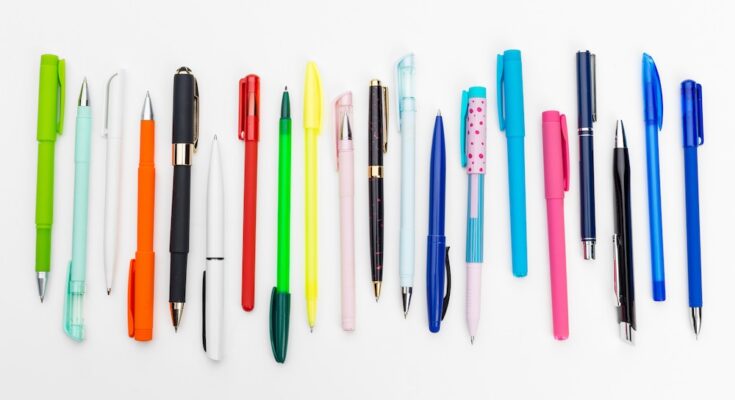
What are the coordinates of `pens with tips facing up` in the screenshot? It's located at (89, 96), (148, 111), (215, 151), (284, 117), (342, 112), (437, 124), (509, 103), (553, 126), (620, 149), (650, 91).